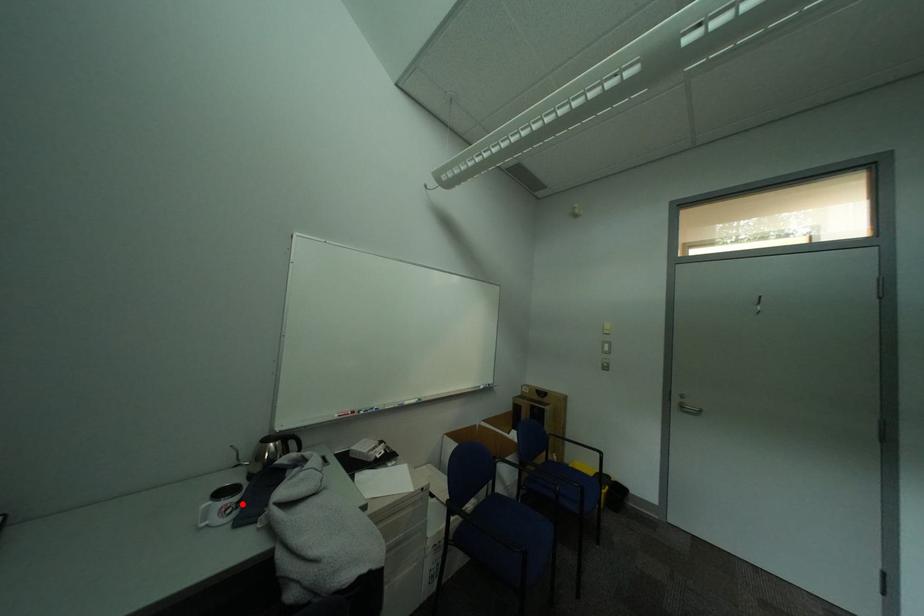
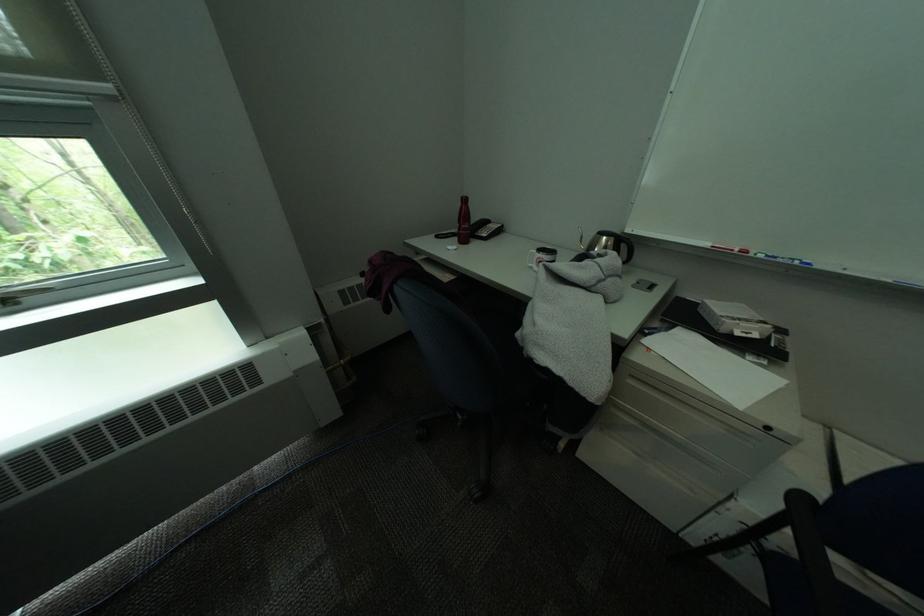
Find the pixel in the second image that matches the highlighted location in the first image.

(553, 260)